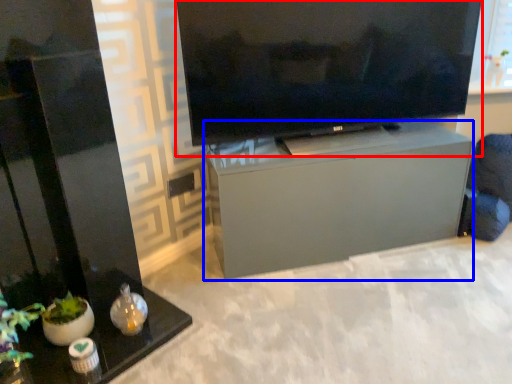
Question: Which of the following is the farthest to the observer, television (highlighted by a red box) or furniture (highlighted by a blue box)?

Choices:
 (A) television
 (B) furniture

Answer: (B)